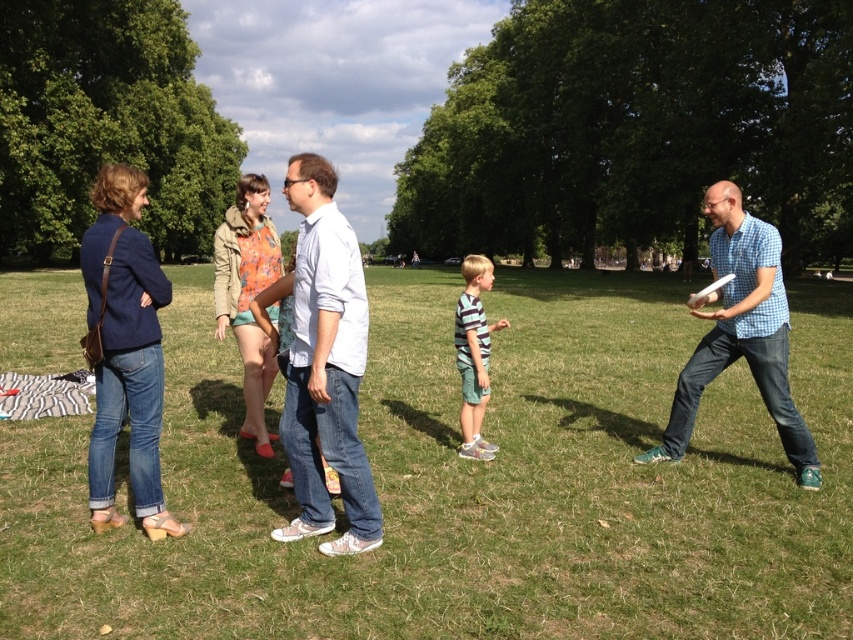
Question: Considering the real-world distances, which object is farthest from the denim jeans at center?

Choices:
 (A) light blue cotton shirt at center
 (B) navy blue denim jacket at left
 (C) white plastic frisbee at right

Answer: (C)

Question: Does denim jeans at center have a smaller size compared to blue checkered shirt at right?

Choices:
 (A) yes
 (B) no

Answer: (A)

Question: Which point is closer to the camera?

Choices:
 (A) denim shorts at center
 (B) green grassy field at center

Answer: (B)

Question: Considering the real-world distances, which object is closest to the denim jeans at center?

Choices:
 (A) blue checkered shirt at right
 (B) white plastic frisbee at right

Answer: (A)

Question: Is navy blue denim jacket at left positioned at the back of blue checkered shirt at right?

Choices:
 (A) yes
 (B) no

Answer: (B)

Question: Can you confirm if navy blue denim jacket at left is positioned below blue checkered shirt at right?

Choices:
 (A) no
 (B) yes

Answer: (B)